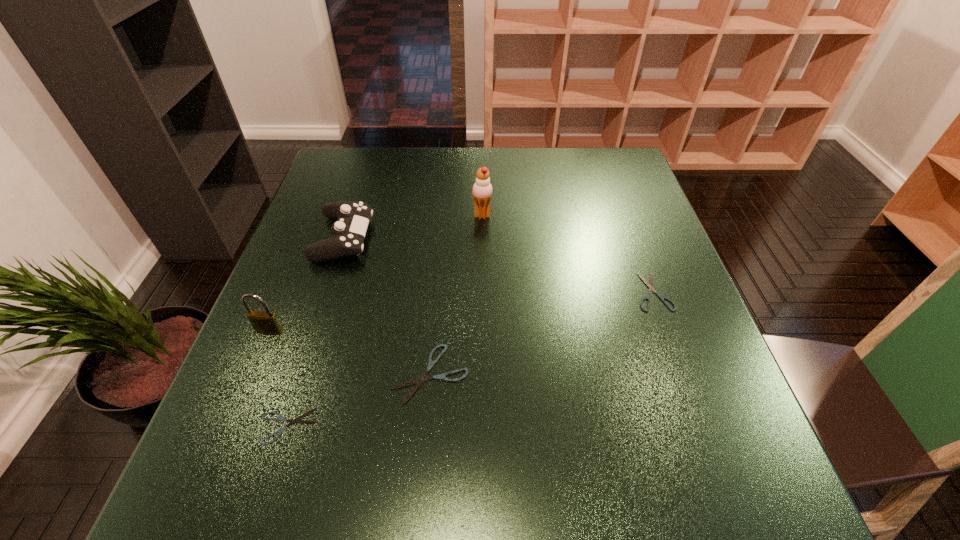
In order to click on vacant space that's between the second object from right to left and the shortest shears in this screenshot , I will do `click(385, 321)`.

Locate an element on the screen. The height and width of the screenshot is (540, 960). free space between the second shears from left to right and the icecream is located at coordinates (456, 295).

The height and width of the screenshot is (540, 960). I want to click on vacant area that lies between the second tallest object and the fifth object from left to right, so click(376, 273).

You are a GUI agent. You are given a task and a screenshot of the screen. Output one action in this format:
    pyautogui.click(x=<x>, y=<y>)
    Task: Click on the vacant area that lies between the second nearest shears and the second tallest object
    
    Given the screenshot: What is the action you would take?
    pyautogui.click(x=350, y=352)

This screenshot has height=540, width=960. Identify the location of free spot between the third tallest object and the nearest shears. (316, 332).

The height and width of the screenshot is (540, 960). Find the location of `empty location between the third object from right to left and the fourth farthest object`. empty location between the third object from right to left and the fourth farthest object is located at coordinates (350, 352).

Where is `free space between the second tallest shears and the leftmost shears`? The height and width of the screenshot is (540, 960). free space between the second tallest shears and the leftmost shears is located at coordinates (470, 359).

Where is `free spot between the fifth tallest object and the control`? free spot between the fifth tallest object and the control is located at coordinates (498, 265).

Where is `free space between the second shears from right to left and the fourth shortest object`? free space between the second shears from right to left and the fourth shortest object is located at coordinates (387, 306).

Image resolution: width=960 pixels, height=540 pixels. Find the location of `empty space between the second object from right to left and the third tallest object`. empty space between the second object from right to left and the third tallest object is located at coordinates (413, 226).